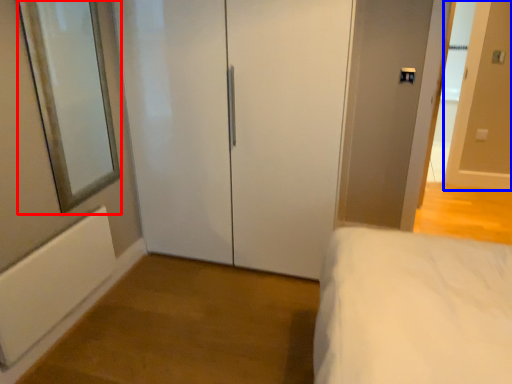
Question: Which of the following is the farthest to the observer, mirror (highlighted by a red box) or door (highlighted by a blue box)?

Choices:
 (A) mirror
 (B) door

Answer: (B)